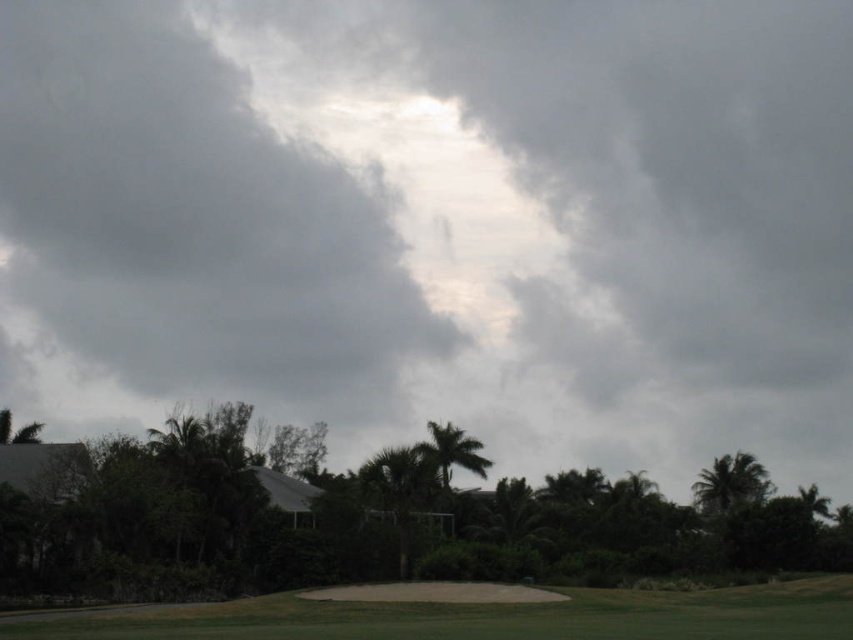
Question: Which of the following is the farthest from the observer?

Choices:
 (A) sandy brown sand trap at lower center
 (B) green leafy palm tree at center
 (C) green leafy tree at center
 (D) green leafy palm tree at upper right

Answer: (D)

Question: Which point is closer to the camera?

Choices:
 (A) sandy brown sand trap at lower center
 (B) green leafy palm tree at center

Answer: (A)

Question: Does sandy brown sand trap at lower center appear on the right side of green leafy palm tree at upper right?

Choices:
 (A) yes
 (B) no

Answer: (B)

Question: Can you confirm if green leafy tree at center is bigger than green leafy palm tree at center?

Choices:
 (A) yes
 (B) no

Answer: (A)

Question: Among these points, which one is nearest to the camera?

Choices:
 (A) (453, 426)
 (B) (740, 477)
 (C) (798, 618)

Answer: (C)

Question: Does green leafy tree at center have a smaller size compared to sandy brown sand trap at lower center?

Choices:
 (A) no
 (B) yes

Answer: (A)